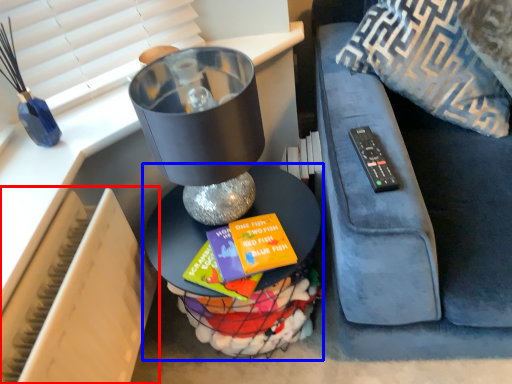
Question: Which of the following is the closest to the observer, radiator (highlighted by a red box) or table (highlighted by a blue box)?

Choices:
 (A) radiator
 (B) table

Answer: (A)